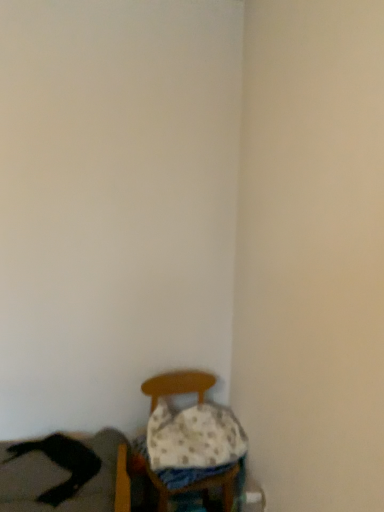
Where is `wooden chair at lower center`? This screenshot has height=512, width=384. wooden chair at lower center is located at coordinates (178, 385).

Measure the distance between wooden chair at lower center and camera.

wooden chair at lower center is 1.76 meters away from camera.

The image size is (384, 512). In order to click on white dotted fabric pillow at lower center in this screenshot , I will do `click(193, 437)`.

Describe the element at coordinates (193, 437) in the screenshot. I see `white dotted fabric pillow at lower center` at that location.

You are a GUI agent. You are given a task and a screenshot of the screen. Output one action in this format:
    pyautogui.click(x=<x>, y=<y>)
    Task: Click on the black leather couch at lower left
    
    Given the screenshot: What is the action you would take?
    pyautogui.click(x=59, y=478)

Can we say white dotted fabric pillow at lower center lies outside wooden chair at lower center?

No, most part of white dotted fabric pillow at lower center lies within wooden chair at lower center.

Is white dotted fabric pillow at lower center behind wooden chair at lower center?

Yes, white dotted fabric pillow at lower center is further from the camera.

Does point (238, 423) come in front of point (199, 397)?

Yes.

From the picture: Between white dotted fabric pillow at lower center and wooden chair at lower center, which one appears on the right side from the viewer's perspective?

Positioned to the right is white dotted fabric pillow at lower center.

From a real-world perspective, is black leather couch at lower left below wooden chair at lower center?

No, from a real-world perspective, black leather couch at lower left is not beneath wooden chair at lower center.

Is the surface of black leather couch at lower left in direct contact with wooden chair at lower center?

No, black leather couch at lower left is not touching wooden chair at lower center.

From the image's perspective, is black leather couch at lower left located beneath wooden chair at lower center?

No.

From the picture: Can you tell me how much black leather couch at lower left and wooden chair at lower center differ in facing direction?

black leather couch at lower left and wooden chair at lower center are facing 5.26 degrees away from each other.

Would you say white dotted fabric pillow at lower center is to the left or to the right of black leather couch at lower left in the picture?

From the image, it's evident that white dotted fabric pillow at lower center is to the right of black leather couch at lower left.

Which object is closer to the camera taking this photo, white dotted fabric pillow at lower center or black leather couch at lower left?

Positioned in front is black leather couch at lower left.

Where is `pillow to the right of black leather couch at lower left`? Image resolution: width=384 pixels, height=512 pixels. pillow to the right of black leather couch at lower left is located at coordinates (193, 437).

Considering the relative sizes of wooden chair at lower center and white dotted fabric pillow at lower center in the image provided, is wooden chair at lower center thinner than white dotted fabric pillow at lower center?

Incorrect, the width of wooden chair at lower center is not less than that of white dotted fabric pillow at lower center.

Could you tell me if wooden chair at lower center is facing white dotted fabric pillow at lower center?

Yes, wooden chair at lower center is facing white dotted fabric pillow at lower center.

Does wooden chair at lower center contain white dotted fabric pillow at lower center?

Absolutely, white dotted fabric pillow at lower center is inside wooden chair at lower center.

From the image's perspective, who appears lower, wooden chair at lower center or white dotted fabric pillow at lower center?

From the image's view, wooden chair at lower center is below.

Is black leather couch at lower left a part of wooden chair at lower center?

Definitely not — black leather couch at lower left is not inside wooden chair at lower center.

What's the angular difference between wooden chair at lower center and black leather couch at lower left's facing directions?

5.26 degrees separate the facing orientations of wooden chair at lower center and black leather couch at lower left.

Is wooden chair at lower center positioned in front of black leather couch at lower left?

No, it is behind black leather couch at lower left.

From a real-world perspective, which object rests below the other?

From a 3D spatial view, wooden chair at lower center is below.

Between black leather couch at lower left and white dotted fabric pillow at lower center, which one has larger width?

Wider between the two is black leather couch at lower left.

Is point (37, 490) positioned after point (192, 465)?

No, (37, 490) is in front of (192, 465).

From the picture: How far apart are black leather couch at lower left and white dotted fabric pillow at lower center?

A distance of 14.34 inches exists between black leather couch at lower left and white dotted fabric pillow at lower center.

Which object is positioned more to the left, black leather couch at lower left or white dotted fabric pillow at lower center?

black leather couch at lower left.

At what (x,y) coordinates should I click in order to perform the action: click on pillow on the right of wooden chair at lower center. Please return your answer as a coordinate pair (x, y). Looking at the image, I should click on (193, 437).

Find the location of `couch on the left of the wooden chair at lower center`. couch on the left of the wooden chair at lower center is located at coordinates [59, 478].

Looking at the image, which one is located further to black leather couch at lower left, wooden chair at lower center or white dotted fabric pillow at lower center?

Among the two, white dotted fabric pillow at lower center is located further to black leather couch at lower left.

From the image, which object appears to be farther from white dotted fabric pillow at lower center, black leather couch at lower left or wooden chair at lower center?

black leather couch at lower left is positioned further to the anchor white dotted fabric pillow at lower center.

Estimate the real-world distances between objects in this image. Which object is closer to white dotted fabric pillow at lower center, wooden chair at lower center or black leather couch at lower left?

wooden chair at lower center is closer to white dotted fabric pillow at lower center.

From the image, which object appears to be farther from wooden chair at lower center, black leather couch at lower left or white dotted fabric pillow at lower center?

Based on the image, black leather couch at lower left appears to be further to wooden chair at lower center.

Looking at the image, which one is located closer to wooden chair at lower center, white dotted fabric pillow at lower center or black leather couch at lower left?

Among the two, white dotted fabric pillow at lower center is located nearer to wooden chair at lower center.

When comparing their distances from black leather couch at lower left, does white dotted fabric pillow at lower center or wooden chair at lower center seem closer?

Based on the image, wooden chair at lower center appears to be nearer to black leather couch at lower left.

Where is `furniture between black leather couch at lower left and white dotted fabric pillow at lower center in the horizontal direction`? furniture between black leather couch at lower left and white dotted fabric pillow at lower center in the horizontal direction is located at coordinates (x=178, y=385).